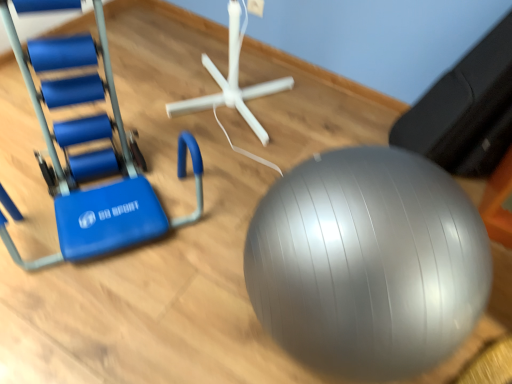
Where is `vacant space that's between silver rubber ball at center and blue rubber swivel chair at left`? The image size is (512, 384). vacant space that's between silver rubber ball at center and blue rubber swivel chair at left is located at coordinates (182, 271).